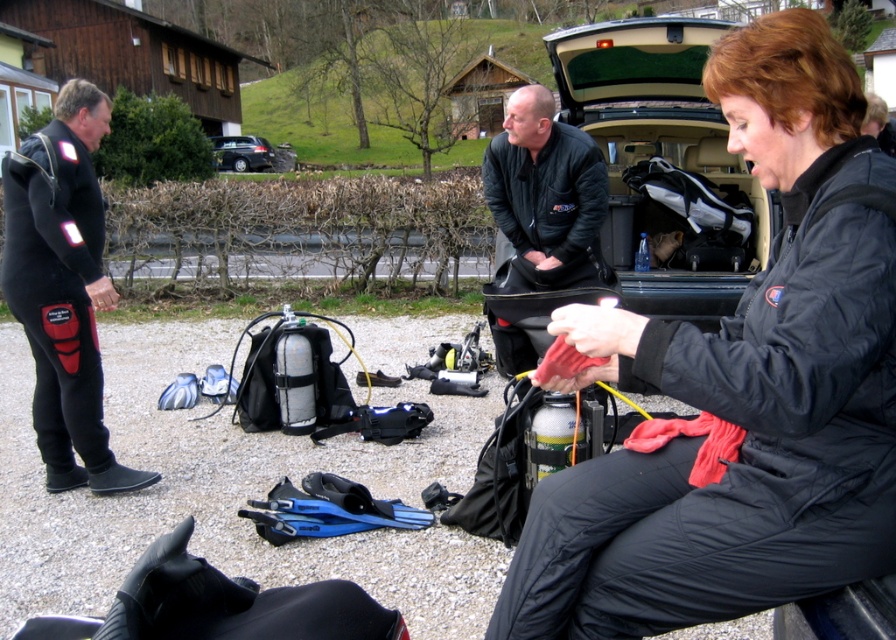
Question: Which object appears farthest from the camera in this image?

Choices:
 (A) black matte wetsuit at left
 (B) blue rubber flippers at center

Answer: (A)

Question: Does black matte jacket at center appear under dark gray metallic car at center?

Choices:
 (A) no
 (B) yes

Answer: (B)

Question: Observing the image, what is the correct spatial positioning of matte black jacket at center in reference to black matte wetsuit at left?

Choices:
 (A) right
 (B) left

Answer: (A)

Question: Which of the following is the closest to the observer?

Choices:
 (A) matte black jacket at center
 (B) black matte jacket at center
 (C) black matte wetsuit at left
 (D) black rubber glove at lower left

Answer: (A)

Question: Which object is the farthest from the black rubber glove at lower left?

Choices:
 (A) black matte jacket at center
 (B) black matte wetsuit at left
 (C) dark gray metallic car at center
 (D) matte black jacket at center

Answer: (C)

Question: Does black matte wetsuit at left have a larger size compared to black matte jacket at center?

Choices:
 (A) no
 (B) yes

Answer: (B)